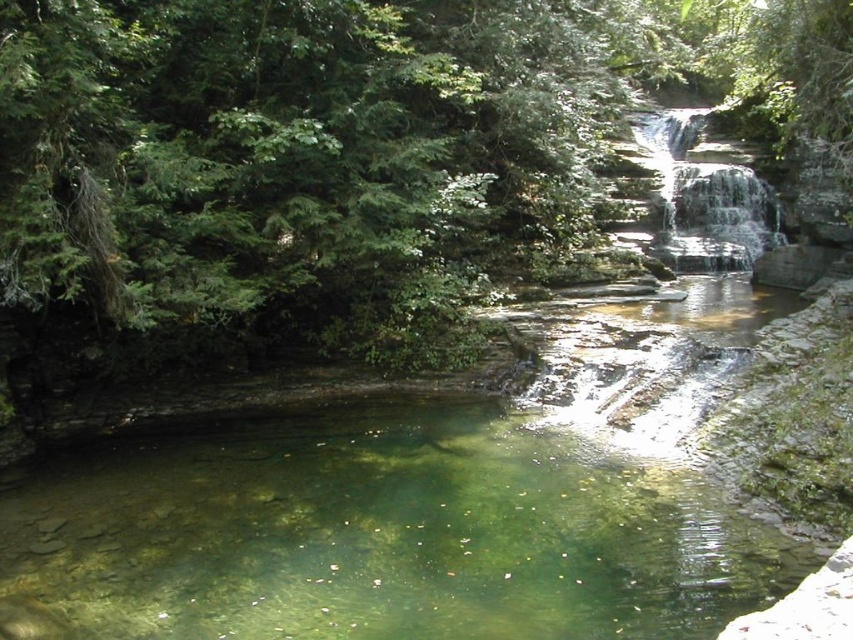
Question: Can you confirm if clear water at center is positioned below clear stone waterfall at upper center?

Choices:
 (A) no
 (B) yes

Answer: (B)

Question: Which of the following is the closest to the observer?

Choices:
 (A) (660, 608)
 (B) (704, 115)

Answer: (A)

Question: Can you confirm if clear water at center is positioned above clear stone waterfall at upper center?

Choices:
 (A) no
 (B) yes

Answer: (A)

Question: Among these points, which one is nearest to the camera?

Choices:
 (A) (393, 588)
 (B) (714, 259)

Answer: (A)

Question: Can you confirm if clear water at center is smaller than clear stone waterfall at upper center?

Choices:
 (A) no
 (B) yes

Answer: (A)